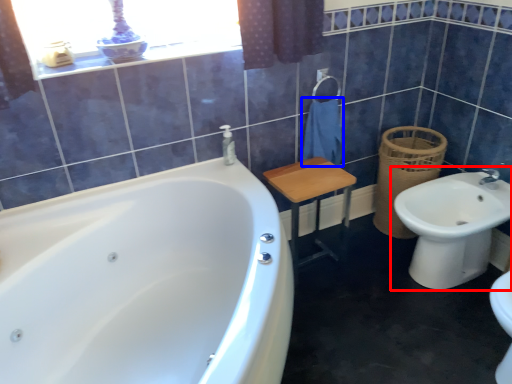
Question: Which object is further to the camera taking this photo, sink (highlighted by a red box) or bath towel (highlighted by a blue box)?

Choices:
 (A) sink
 (B) bath towel

Answer: (B)